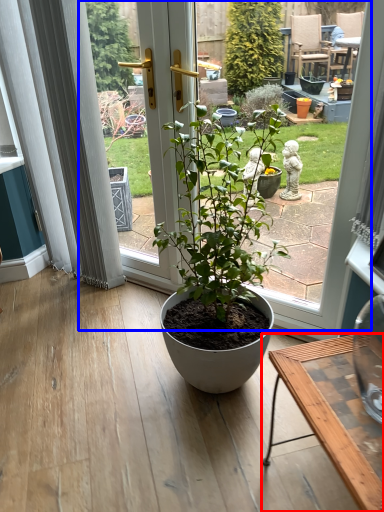
Question: Which object is further to the camera taking this photo, desk (highlighted by a red box) or bay window (highlighted by a blue box)?

Choices:
 (A) desk
 (B) bay window

Answer: (B)